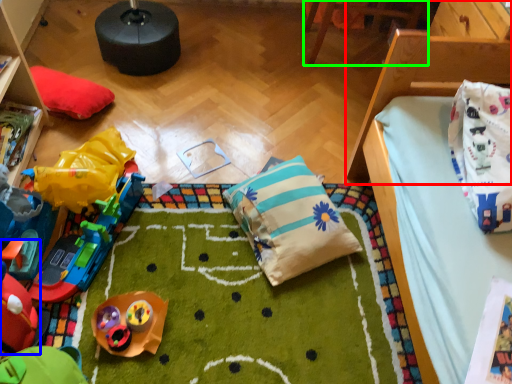
Question: Which is nearer to the furniture (highlighted by a red box)? toy (highlighted by a blue box) or furniture (highlighted by a green box).

Choices:
 (A) toy
 (B) furniture

Answer: (B)